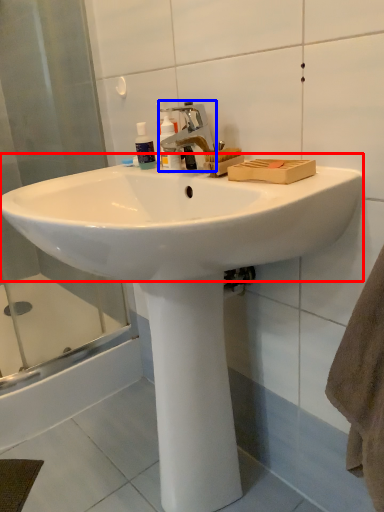
Question: Which object is closer to the camera taking this photo, sink (highlighted by a red box) or tap (highlighted by a blue box)?

Choices:
 (A) sink
 (B) tap

Answer: (A)